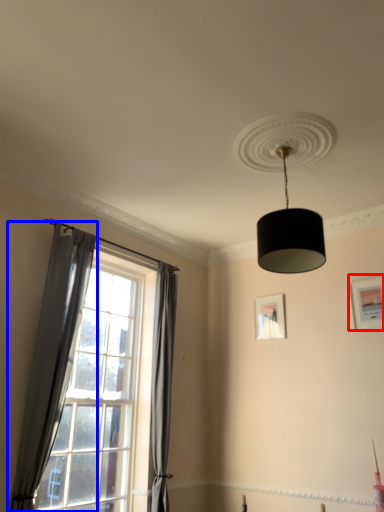
Question: Which point is further to the camera, picture frame (highlighted by a red box) or curtain (highlighted by a blue box)?

Choices:
 (A) picture frame
 (B) curtain

Answer: (A)